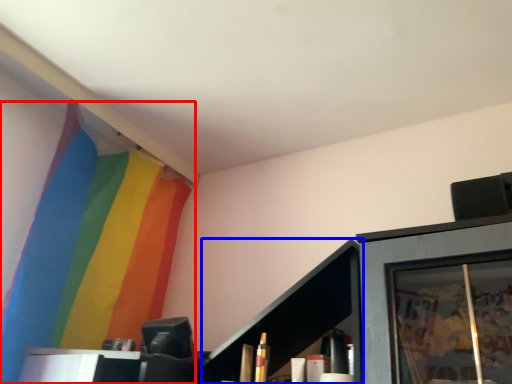
Question: Which object is further to the camera taking this photo, curtain (highlighted by a red box) or cabinet (highlighted by a blue box)?

Choices:
 (A) curtain
 (B) cabinet

Answer: (A)